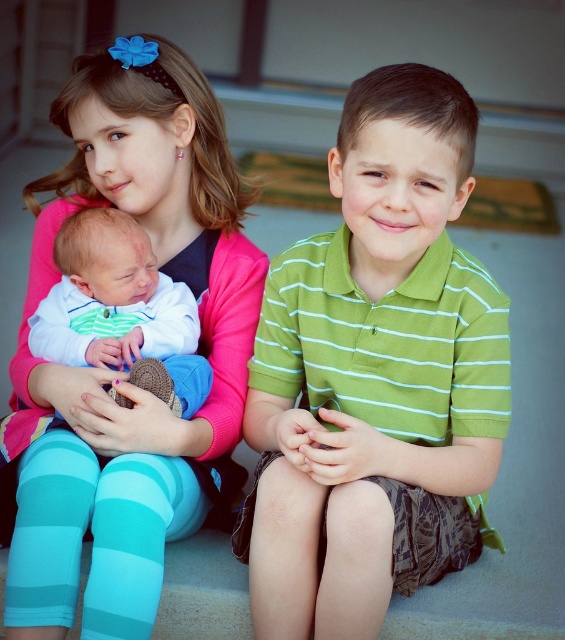
Does pink fabric at upper left have a greater width compared to striped cotton onesie at lower left?

Indeed, pink fabric at upper left has a greater width compared to striped cotton onesie at lower left.

Does pink fabric at upper left appear on the right side of striped cotton onesie at lower left?

Incorrect, pink fabric at upper left is not on the right side of striped cotton onesie at lower left.

Which is behind, point (241, 374) or point (155, 300)?

Point (241, 374)

Locate an element on the screen. Image resolution: width=565 pixels, height=640 pixels. pink fabric at upper left is located at coordinates (x=119, y=371).

Based on the photo, does green striped polo shirt at center have a lesser width compared to striped cotton onesie at lower left?

No.

Can you confirm if green striped polo shirt at center is positioned above striped cotton onesie at lower left?

No.

Where is `green striped polo shirt at center`? Image resolution: width=565 pixels, height=640 pixels. green striped polo shirt at center is located at coordinates (375, 374).

Can you confirm if green striped polo shirt at center is positioned above pink fabric at upper left?

No, green striped polo shirt at center is not above pink fabric at upper left.

Is point (275, 356) positioned after point (128, 97)?

Yes, point (275, 356) is farther from viewer.

In order to click on green striped polo shirt at center in this screenshot , I will do `click(375, 374)`.